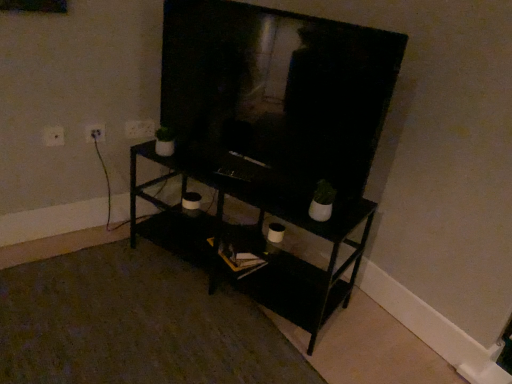
This screenshot has width=512, height=384. What do you see at coordinates (95, 133) in the screenshot?
I see `white plastic electric outlet at upper left, which is counted as the 2th electric outlet, starting from the back` at bounding box center [95, 133].

You are a GUI agent. You are given a task and a screenshot of the screen. Output one action in this format:
    pyautogui.click(x=<x>, y=<y>)
    Task: Click on the white plastic electric outlet at upper left, which is counted as the first electric outlet, starting from the back
    
    Given the screenshot: What is the action you would take?
    pyautogui.click(x=139, y=129)

How much space does white plastic electric outlet at upper left, which ranks as the first electric outlet in front-to-back order, occupy vertically?

It is 9.09 centimeters.

Where is `black matte shelf at center`? This screenshot has height=384, width=512. black matte shelf at center is located at coordinates (258, 233).

Is the depth of black matte shelf at center less than that of white plastic electric outlet at upper left, the 1th electric outlet when ordered from left to right?

Yes.

From a real-world perspective, which electric outlet is the 2nd one above the black matte shelf at center? Please provide its 2D coordinates.

[(53, 136)]

Is black matte shelf at center not near white plastic electric outlet at upper left, the 1th electric outlet when ordered from left to right?

That's not correct — black matte shelf at center is a little close to white plastic electric outlet at upper left, the 1th electric outlet when ordered from left to right.

Is black matte shelf at center looking in the opposite direction of white plastic electric outlet at upper left, which ranks as the first electric outlet in front-to-back order?

black matte shelf at center does not have its back to white plastic electric outlet at upper left, which ranks as the first electric outlet in front-to-back order.

Would you say white plastic electric outlet at upper left, which ranks as the first electric outlet in front-to-back order, is outside white plastic electric outlet at upper left, which is counted as the 2th electric outlet, starting from the back?

Yes, white plastic electric outlet at upper left, which ranks as the first electric outlet in front-to-back order, is outside of white plastic electric outlet at upper left, which is counted as the 2th electric outlet, starting from the back.

From a real-world perspective, between white plastic electric outlet at upper left, which ranks as the first electric outlet in front-to-back order, and white plastic electric outlet at upper left, the 2th electric outlet when ordered from right to left, who is vertically higher?

white plastic electric outlet at upper left, which ranks as the first electric outlet in front-to-back order.

From the picture: From the image's perspective, is white plastic electric outlet at upper left, the 1th electric outlet when ordered from left to right, on top of white plastic electric outlet at upper left, the second electric outlet positioned from the left?

Incorrect, from the image's perspective, white plastic electric outlet at upper left, the 1th electric outlet when ordered from left to right, is lower than white plastic electric outlet at upper left, the second electric outlet positioned from the left.

From the image's perspective, which is below, white plastic electric outlet at upper left, the third electric outlet when ordered from front to back, or white plastic electric outlet at upper left, which is counted as the third electric outlet, starting from the right?

white plastic electric outlet at upper left, which is counted as the third electric outlet, starting from the right, is shown below in the image.

From a real-world perspective, is white plastic electric outlet at upper left, which is counted as the first electric outlet, starting from the back, under white plastic electric outlet at upper left, the 3th electric outlet when ordered from back to front?

Incorrect, from a real-world perspective, white plastic electric outlet at upper left, which is counted as the first electric outlet, starting from the back, is higher than white plastic electric outlet at upper left, the 3th electric outlet when ordered from back to front.

Looking at this image, is white plastic electric outlet at upper left, the third electric outlet when ordered from front to back, completely or partially outside of white plastic electric outlet at upper left, the 3th electric outlet when ordered from back to front?

Yes.

Does white plastic electric outlet at upper left, the 1th electric outlet from the right, appear on the left side of white plastic electric outlet at upper left, which ranks as the first electric outlet in front-to-back order?

No.

Is black matte shelf at center positioned beyond the bounds of white plastic electric outlet at upper left, acting as the 2th electric outlet starting from the front?

black matte shelf at center is positioned outside white plastic electric outlet at upper left, acting as the 2th electric outlet starting from the front.

Is black matte shelf at center oriented away from white plastic electric outlet at upper left, the 2th electric outlet when ordered from right to left?

No, black matte shelf at center is not facing away from white plastic electric outlet at upper left, the 2th electric outlet when ordered from right to left.

From a real-world perspective, which object rests below the other?

black matte shelf at center.

Can you see white plastic electric outlet at upper left, which is counted as the first electric outlet, starting from the back, touching white plastic electric outlet at upper left, the 2th electric outlet when ordered from right to left?

No.

Which is more to the left, white plastic electric outlet at upper left, which is counted as the first electric outlet, starting from the back, or white plastic electric outlet at upper left, acting as the 2th electric outlet starting from the front?

white plastic electric outlet at upper left, acting as the 2th electric outlet starting from the front.

From the image's perspective, is white plastic electric outlet at upper left, the third electric outlet when ordered from front to back, located above white plastic electric outlet at upper left, the second electric outlet positioned from the left?

Yes, from the image's perspective, white plastic electric outlet at upper left, the third electric outlet when ordered from front to back, is over white plastic electric outlet at upper left, the second electric outlet positioned from the left.

In the scene shown: Which is further, (127, 138) or (100, 133)?

The point (127, 138) is more distant.

Identify the location of electric outlet above the white plastic electric outlet at upper left, the second electric outlet positioned from the left (from the image's perspective). (139, 129).

Is white plastic electric outlet at upper left, acting as the 2th electric outlet starting from the front, facing towards white plastic electric outlet at upper left, the third electric outlet when ordered from front to back?

No, white plastic electric outlet at upper left, acting as the 2th electric outlet starting from the front, does not turn towards white plastic electric outlet at upper left, the third electric outlet when ordered from front to back.

From a real-world perspective, does white plastic electric outlet at upper left, the 2th electric outlet when ordered from right to left, stand above white plastic electric outlet at upper left, the third electric outlet when ordered from front to back?

No, from a real-world perspective, white plastic electric outlet at upper left, the 2th electric outlet when ordered from right to left, is not over white plastic electric outlet at upper left, the third electric outlet when ordered from front to back

Looking at this image, does white plastic electric outlet at upper left, the 1th electric outlet when ordered from left to right, have a larger size compared to black matte shelf at center?

No.

Does white plastic electric outlet at upper left, which ranks as the first electric outlet in front-to-back order, have a lesser width compared to black matte shelf at center?

Correct, the width of white plastic electric outlet at upper left, which ranks as the first electric outlet in front-to-back order, is less than that of black matte shelf at center.

Consider the image. Could you measure the distance between white plastic electric outlet at upper left, which is counted as the third electric outlet, starting from the right, and black matte shelf at center?

white plastic electric outlet at upper left, which is counted as the third electric outlet, starting from the right, and black matte shelf at center are 36.84 inches apart.

Is black matte shelf at center located within white plastic electric outlet at upper left, the 3th electric outlet when ordered from back to front?

Definitely not — black matte shelf at center is not inside white plastic electric outlet at upper left, the 3th electric outlet when ordered from back to front.

Locate an element on the screen. shelf lying in front of the white plastic electric outlet at upper left, which is counted as the third electric outlet, starting from the right is located at coordinates (258, 233).

Identify the location of electric outlet that is the 1st object located above the white plastic electric outlet at upper left, the 3th electric outlet when ordered from back to front (from the image's perspective). The width and height of the screenshot is (512, 384). (95, 133).

When comparing their distances from white plastic electric outlet at upper left, which is counted as the third electric outlet, starting from the right, does white plastic electric outlet at upper left, the second electric outlet positioned from the left, or white plastic electric outlet at upper left, which is counted as the first electric outlet, starting from the back, seem further?

white plastic electric outlet at upper left, which is counted as the first electric outlet, starting from the back, is further to white plastic electric outlet at upper left, which is counted as the third electric outlet, starting from the right.

From the image, which object appears to be farther from white plastic electric outlet at upper left, which is counted as the first electric outlet, starting from the back, black matte shelf at center or white plastic electric outlet at upper left, the second electric outlet positioned from the left?

The object further to white plastic electric outlet at upper left, which is counted as the first electric outlet, starting from the back, is black matte shelf at center.

When comparing their distances from white plastic electric outlet at upper left, which is counted as the third electric outlet, starting from the right, does white plastic electric outlet at upper left, which is counted as the 2th electric outlet, starting from the back, or black matte shelf at center seem closer?

white plastic electric outlet at upper left, which is counted as the 2th electric outlet, starting from the back, lies closer to white plastic electric outlet at upper left, which is counted as the third electric outlet, starting from the right, than the other object.

Looking at this image, considering their positions, is white plastic electric outlet at upper left, the second electric outlet positioned from the left, positioned further to white plastic electric outlet at upper left, the 1th electric outlet from the right, than black matte shelf at center?

Based on the image, black matte shelf at center appears to be further to white plastic electric outlet at upper left, the 1th electric outlet from the right.

When comparing their distances from white plastic electric outlet at upper left, the 2th electric outlet when ordered from right to left, does black matte shelf at center or white plastic electric outlet at upper left, the third electric outlet positioned from the left, seem closer?

The object closer to white plastic electric outlet at upper left, the 2th electric outlet when ordered from right to left, is white plastic electric outlet at upper left, the third electric outlet positioned from the left.

Which object lies nearer to the anchor point black matte shelf at center, white plastic electric outlet at upper left, the 3th electric outlet when ordered from back to front, or white plastic electric outlet at upper left, the third electric outlet positioned from the left?

white plastic electric outlet at upper left, the third electric outlet positioned from the left, lies closer to black matte shelf at center than the other object.

Considering their positions, is white plastic electric outlet at upper left, which is counted as the 2th electric outlet, starting from the back, positioned closer to black matte shelf at center than white plastic electric outlet at upper left, the 1th electric outlet when ordered from left to right?

white plastic electric outlet at upper left, which is counted as the 2th electric outlet, starting from the back, lies closer to black matte shelf at center than the other object.

From the image, which object appears to be farther from white plastic electric outlet at upper left, which is counted as the third electric outlet, starting from the right, white plastic electric outlet at upper left, which is counted as the first electric outlet, starting from the back, or black matte shelf at center?

black matte shelf at center.

You are a GUI agent. You are given a task and a screenshot of the screen. Output one action in this format:
    pyautogui.click(x=<x>, y=<y>)
    Task: Click on the electric outlet situated between white plastic electric outlet at upper left, which ranks as the first electric outlet in front-to-back order, and white plastic electric outlet at upper left, the 1th electric outlet from the right, from left to right
    The image size is (512, 384).
    Given the screenshot: What is the action you would take?
    pyautogui.click(x=95, y=133)